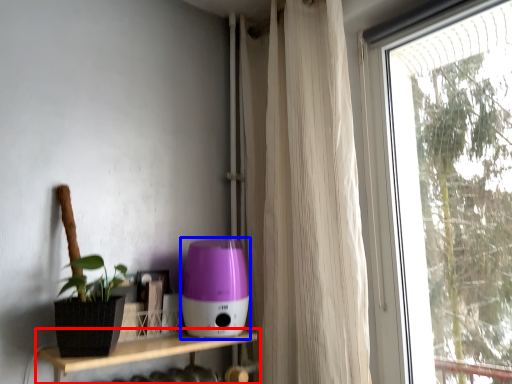
Question: Among these objects, which one is farthest to the camera, shelf (highlighted by a red box) or appliance (highlighted by a blue box)?

Choices:
 (A) shelf
 (B) appliance

Answer: (B)